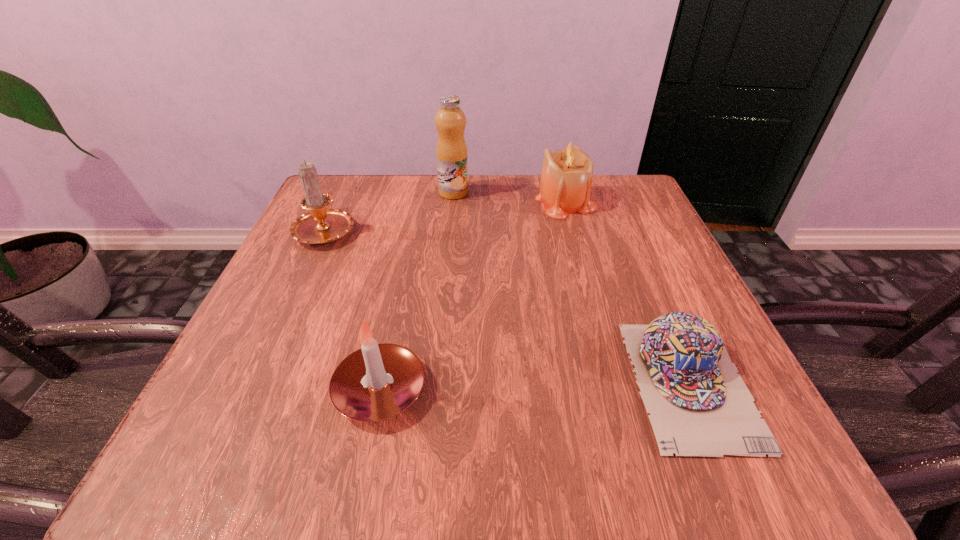
Locate an element on the screen. This screenshot has height=540, width=960. candle at the near edge is located at coordinates coord(379,381).

At what (x,y) coordinates should I click in order to perform the action: click on cap that is positioned at the near edge. Please return your answer as a coordinate pair (x, y). This screenshot has width=960, height=540. Looking at the image, I should click on (699, 406).

The image size is (960, 540). I want to click on object situated at the left edge, so click(321, 225).

I want to click on candle that is at the right edge, so point(566,180).

Image resolution: width=960 pixels, height=540 pixels. Identify the location of cap positioned at the right edge. (699, 406).

Image resolution: width=960 pixels, height=540 pixels. I want to click on object located in the far left corner section of the desktop, so click(x=321, y=225).

At what (x,y) coordinates should I click in order to perform the action: click on object located at the far right corner. Please return your answer as a coordinate pair (x, y). Image resolution: width=960 pixels, height=540 pixels. Looking at the image, I should click on (566, 180).

You are a GUI agent. You are given a task and a screenshot of the screen. Output one action in this format:
    pyautogui.click(x=<x>, y=<y>)
    Task: Click on the object present at the near right corner
    
    Given the screenshot: What is the action you would take?
    pyautogui.click(x=699, y=406)

I want to click on blank area at the far edge, so click(x=494, y=206).

Where is `vacant area at the left edge of the desktop`? vacant area at the left edge of the desktop is located at coordinates (294, 274).